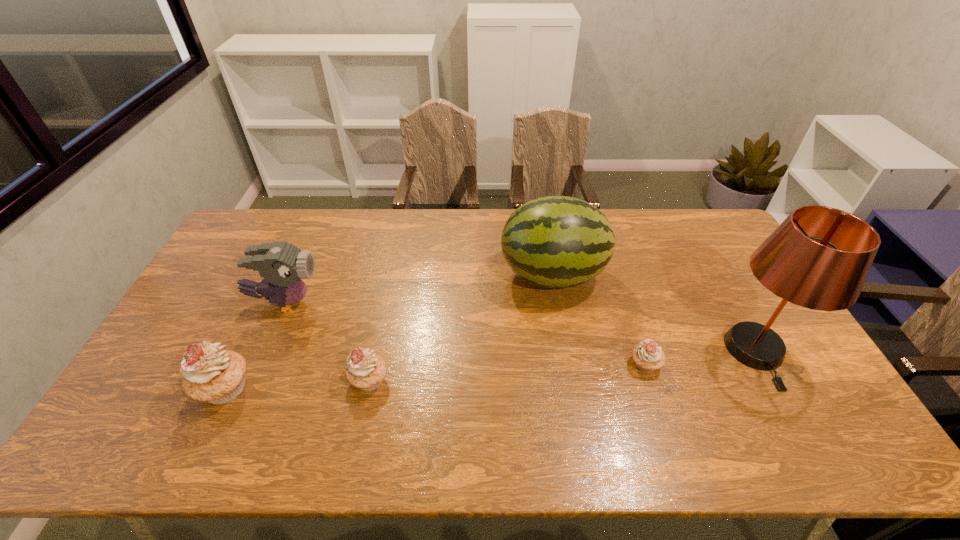
At what (x,y) coordinates should I click in order to perform the action: click on object present at the left edge. Please return your answer as a coordinate pair (x, y). Image resolution: width=960 pixels, height=540 pixels. Looking at the image, I should click on (210, 374).

At what (x,y) coordinates should I click in order to perform the action: click on object present at the right edge. Please return your answer as a coordinate pair (x, y). Image resolution: width=960 pixels, height=540 pixels. Looking at the image, I should click on (819, 257).

Where is `object that is positioned at the near left corner`? The width and height of the screenshot is (960, 540). object that is positioned at the near left corner is located at coordinates (210, 374).

At what (x,y) coordinates should I click in order to perform the action: click on object at the near right corner. Please return your answer as a coordinate pair (x, y). The height and width of the screenshot is (540, 960). Looking at the image, I should click on (819, 257).

Find the location of a particular element. Image resolution: width=960 pixels, height=540 pixels. blank space at the far edge is located at coordinates (612, 225).

Identify the location of free location at the near edge of the desktop. This screenshot has height=540, width=960. (761, 412).

The height and width of the screenshot is (540, 960). In the image, there is a desktop. Find the location of `free space at the left edge`. free space at the left edge is located at coordinates (228, 332).

Find the location of a particular element. The image size is (960, 540). vacant region at the right edge is located at coordinates click(799, 381).

Locate an element on the screen. This screenshot has height=540, width=960. blank area at the far left corner is located at coordinates (278, 212).

Locate an element on the screen. This screenshot has height=540, width=960. vacant space at the far right corner is located at coordinates (710, 218).